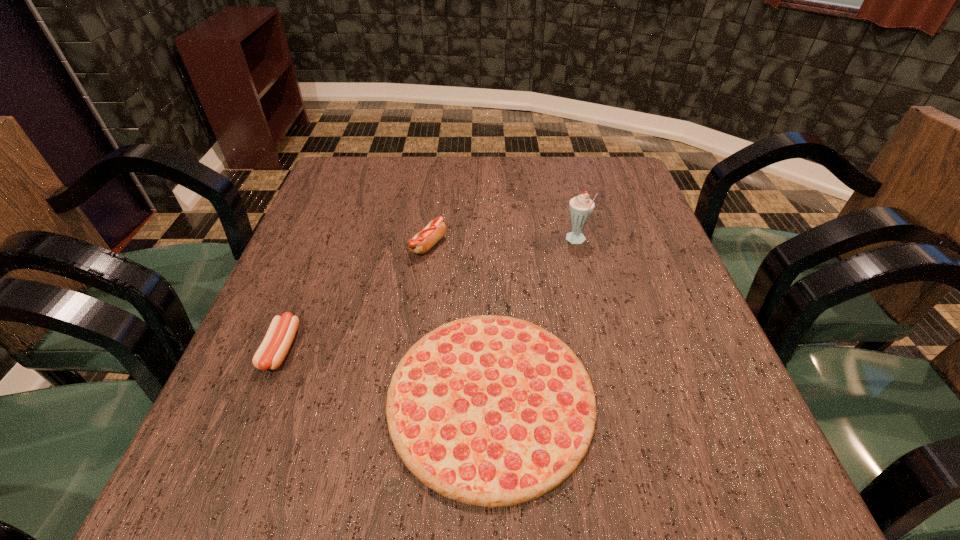
What are the coordinates of `vacant space that satisfies the following two spatial constraints: 1. on the straw side of the rightmost object; 2. on the front side of the second tallest object` in the screenshot? It's located at (577, 246).

The height and width of the screenshot is (540, 960). Find the location of `free region that satisfies the following two spatial constraints: 1. on the back side of the right sausage; 2. on the left side of the shorter sausage`. free region that satisfies the following two spatial constraints: 1. on the back side of the right sausage; 2. on the left side of the shorter sausage is located at coordinates (322, 246).